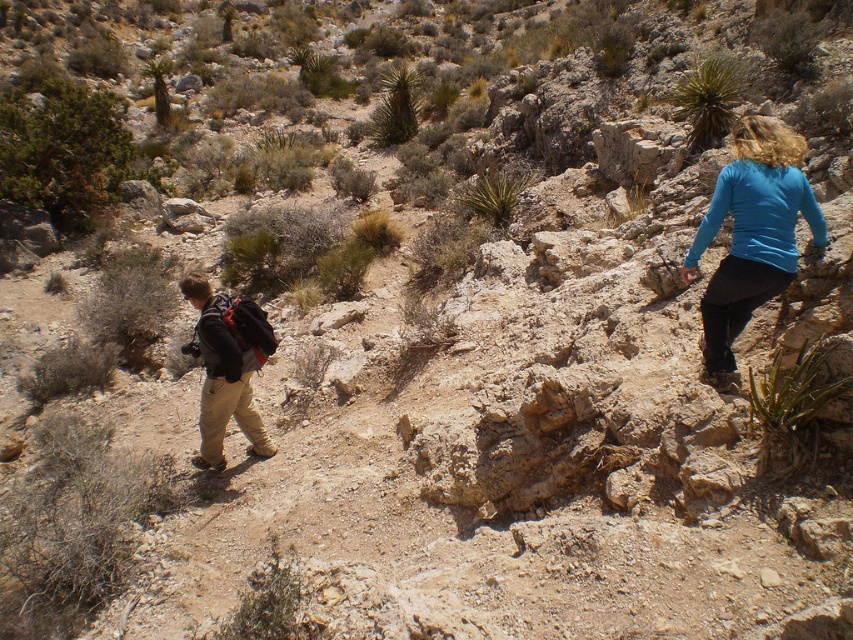
Question: Which object is farther from the camera taking this photo?

Choices:
 (A) green leafy bush at lower center
 (B) green shrub at upper left
 (C) blue matte shirt at upper right
 (D) green spiky plant at upper right

Answer: (B)

Question: Which point appears closest to the camera in this image?

Choices:
 (A) (814, 202)
 (B) (39, 195)
 (C) (233, 365)

Answer: (A)

Question: Does green shrub at upper left have a larger size compared to green spiky plant at center?

Choices:
 (A) yes
 (B) no

Answer: (A)

Question: Does green shrub at upper left appear under green spiky plant at upper right?

Choices:
 (A) yes
 (B) no

Answer: (B)

Question: Which point is closer to the camera taking this photo?

Choices:
 (A) (753, 250)
 (B) (6, 93)
 (C) (238, 316)

Answer: (A)

Question: Is green spiky plant at upper right wider than green spiky plant at center?

Choices:
 (A) no
 (B) yes

Answer: (A)